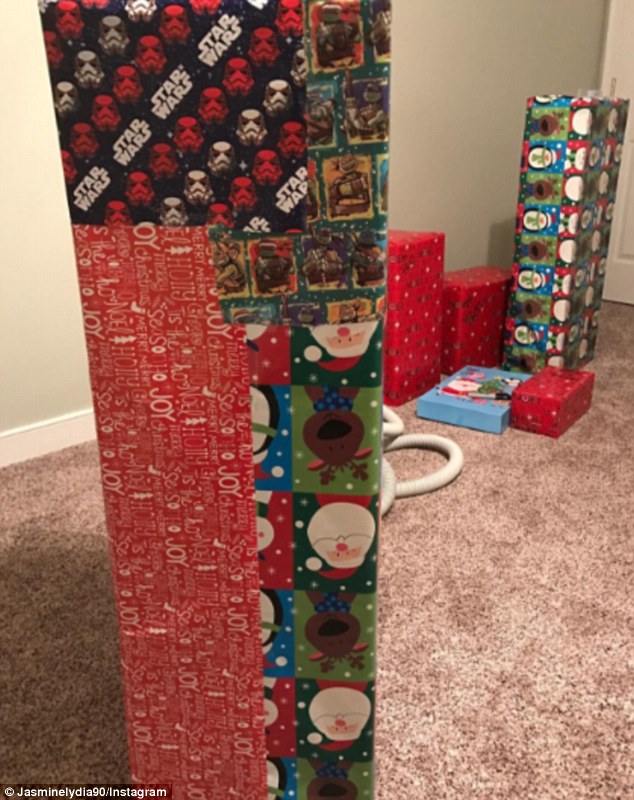
Where is `carpet`? The width and height of the screenshot is (634, 800). carpet is located at coordinates (63, 520), (558, 526), (612, 344).